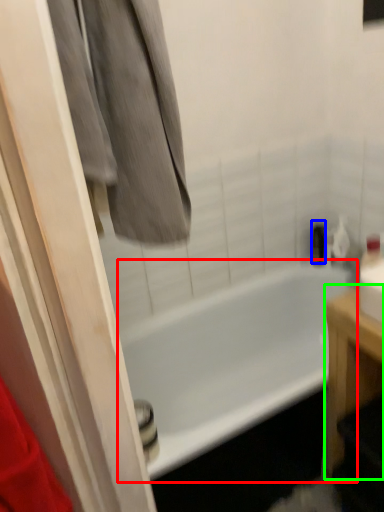
Question: Based on their relative distances, which object is farther from bathtub (highlighted by a red box)? Choose from toiletry (highlighted by a blue box) and furniture (highlighted by a green box).

Choices:
 (A) toiletry
 (B) furniture

Answer: (B)